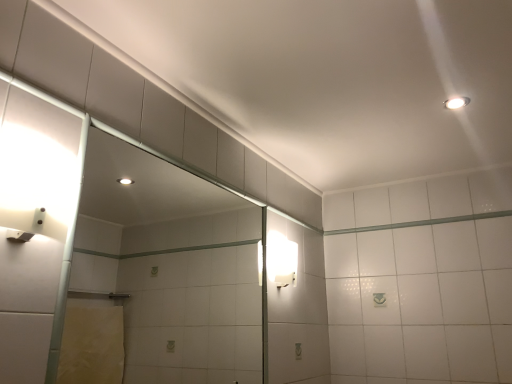
Question: Would you say white frosted glass sconce at right, which is the second light fixture from front to back, is inside or outside white glossy light fixture at upper right, placed as the first light fixture when sorted from right to left?

Choices:
 (A) outside
 (B) inside

Answer: (A)

Question: Considering their positions, is white frosted glass sconce at right, arranged as the 1th light fixture when viewed from the back, located in front of or behind white glossy light fixture at upper right, the 2th light fixture positioned from the bottom?

Choices:
 (A) behind
 (B) front

Answer: (A)

Question: Considering the real-world distances, which object is closest to the clear glass door at left?

Choices:
 (A) white frosted glass sconce at right, the 2th light fixture positioned from the right
 (B) white glossy light fixture at upper right, which is the first light fixture from front to back

Answer: (A)

Question: Which object is positioned closest to the clear glass door at left?

Choices:
 (A) white glossy light fixture at upper right, which appears as the second light fixture when viewed from the left
 (B) white frosted glass sconce at right, the 2th light fixture positioned from the top

Answer: (B)